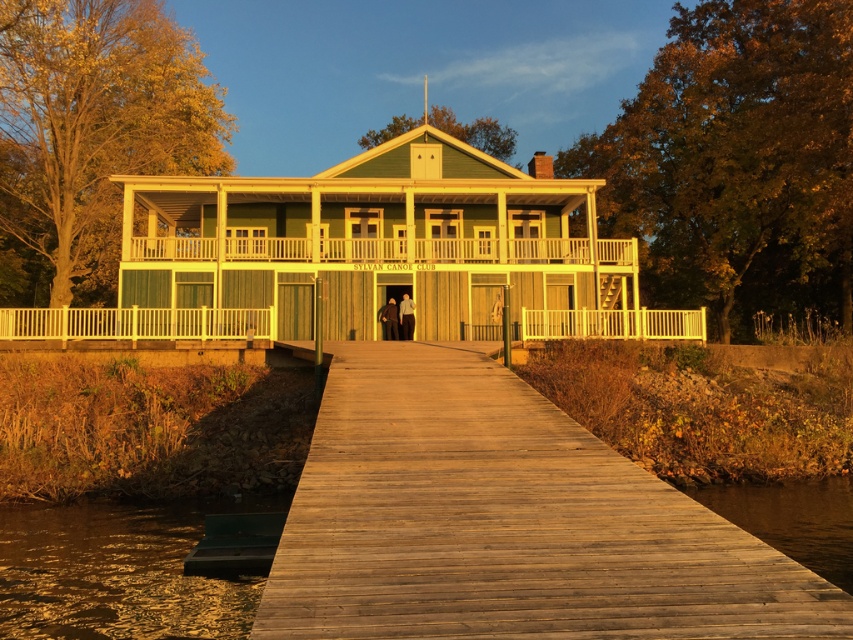
Question: Among these points, which one is nearest to the camera?

Choices:
 (A) (22, 332)
 (B) (173, 593)
 (C) (694, 618)
 (D) (320, 250)

Answer: (C)

Question: Which of these objects is positioned farthest from the wooden dock at center?

Choices:
 (A) green wood water at lower left
 (B) wooden porch at center

Answer: (B)

Question: Which object is closer to the camera taking this photo?

Choices:
 (A) dark brown wood at lower right
 (B) wooden dock at center
 (C) green wood water at lower left
 (D) white wooden railing at left

Answer: (B)

Question: Is green wood water at lower left positioned before wooden porch at center?

Choices:
 (A) yes
 (B) no

Answer: (A)

Question: Does wooden dock at center appear under white wooden railing at left?

Choices:
 (A) yes
 (B) no

Answer: (A)

Question: Can you confirm if wooden porch at center is thinner than white wooden railing at left?

Choices:
 (A) yes
 (B) no

Answer: (B)